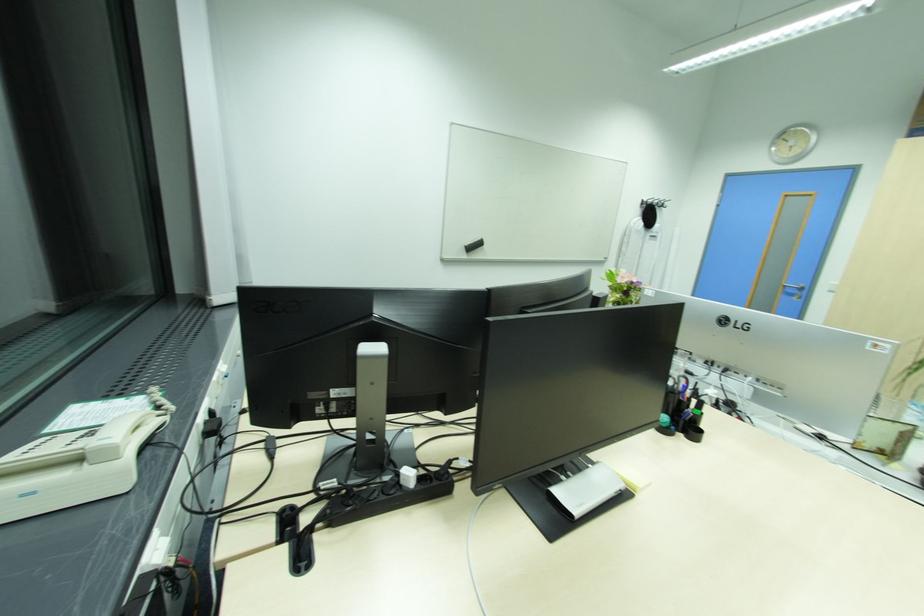
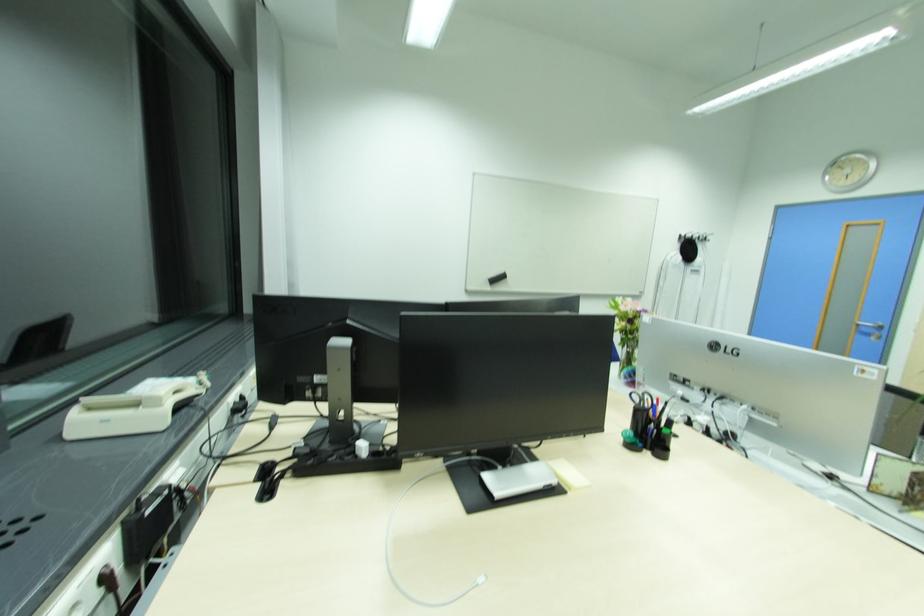
The images are taken continuously from a first-person perspective. In which direction are you moving?

The movement direction of the cameraman is right, backward.